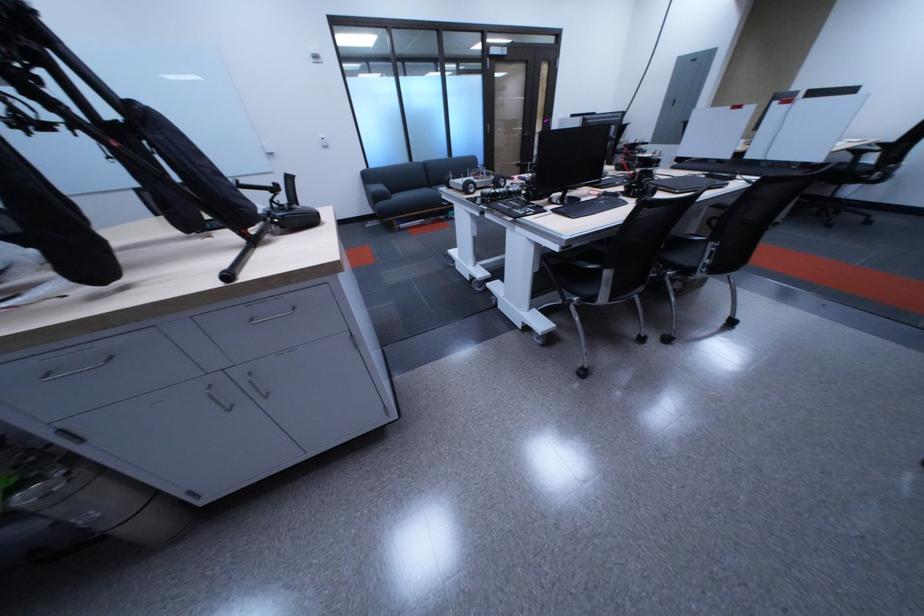
Locate an element on the screen. sofa sitting surface is located at coordinates (418, 195).